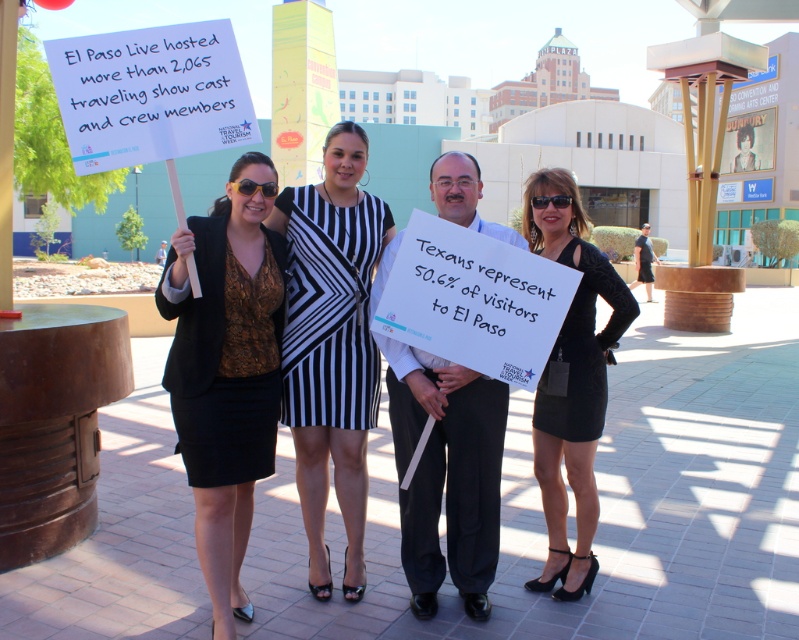
What do you see at coordinates (332, 344) in the screenshot? I see `black and white striped dress at center` at bounding box center [332, 344].

Is black and white striped dress at center taller than black velvet dress at center?

Correct, black and white striped dress at center is much taller as black velvet dress at center.

Is point (344, 349) positioned in front of point (570, 371)?

No, it is behind (570, 371).

Find the location of a particular element. The image size is (799, 640). black and white striped dress at center is located at coordinates (332, 344).

Can you confirm if matte gold blouse at left is positioned to the left of black velvet dress at center?

Indeed, matte gold blouse at left is positioned on the left side of black velvet dress at center.

Is matte gold blouse at left further to camera compared to black velvet dress at center?

No, it is in front of black velvet dress at center.

What do you see at coordinates (225, 371) in the screenshot? I see `matte gold blouse at left` at bounding box center [225, 371].

Where is `matte gold blouse at left`? matte gold blouse at left is located at coordinates (225, 371).

Is matte gold blouse at left closer to the viewer compared to black and white striped dress at center?

That is True.

Describe the element at coordinates (225, 371) in the screenshot. I see `matte gold blouse at left` at that location.

This screenshot has width=799, height=640. Find the location of `matte gold blouse at left`. matte gold blouse at left is located at coordinates (225, 371).